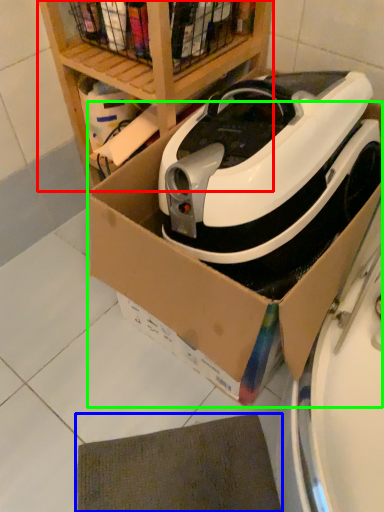
Question: Which object is the closest to the shelf (highlighted by a red box)? Choose among these: mat (highlighted by a blue box) or cardboard box (highlighted by a green box).

Choices:
 (A) mat
 (B) cardboard box

Answer: (B)